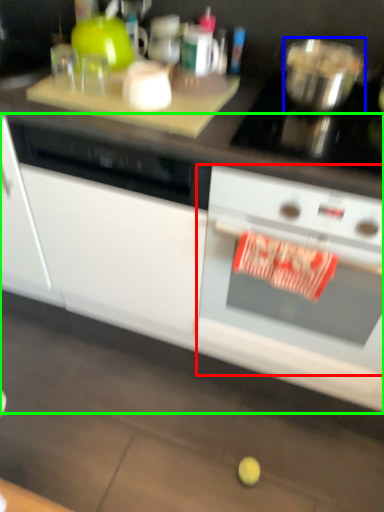
Question: Based on their relative distances, which object is farther from kitchen appliance (highlighted by a red box)? Choose from bowl (highlighted by a blue box) and cabinetry (highlighted by a green box).

Choices:
 (A) bowl
 (B) cabinetry

Answer: (A)